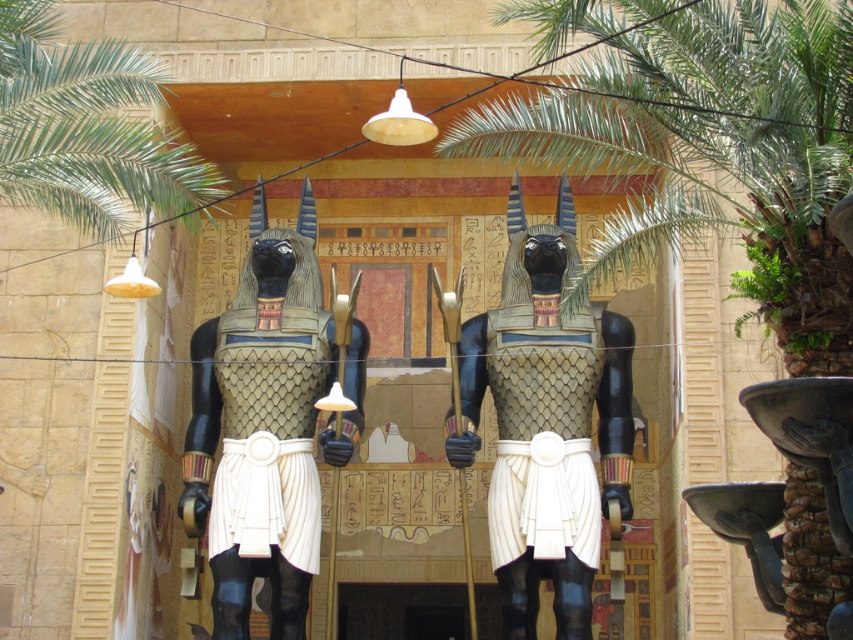
Question: Which object is closer to the camera taking this photo?

Choices:
 (A) matte black statue at center
 (B) green leafy palm at upper left

Answer: (B)

Question: Among these points, which one is nearest to the camera?

Choices:
 (A) (270, 518)
 (B) (801, 131)
 (C) (189, 154)
 (D) (527, 416)

Answer: (B)

Question: Which point is farther to the camera?

Choices:
 (A) (48, 10)
 (B) (689, 122)

Answer: (A)

Question: Can you confirm if green leafy palm tree at center is positioned to the left of matte black statue at center?

Choices:
 (A) yes
 (B) no

Answer: (B)

Question: Does matte gold armor at center come behind matte black statue at center?

Choices:
 (A) no
 (B) yes

Answer: (B)

Question: Does matte gold armor at center appear under matte black statue at center?

Choices:
 (A) no
 (B) yes

Answer: (A)